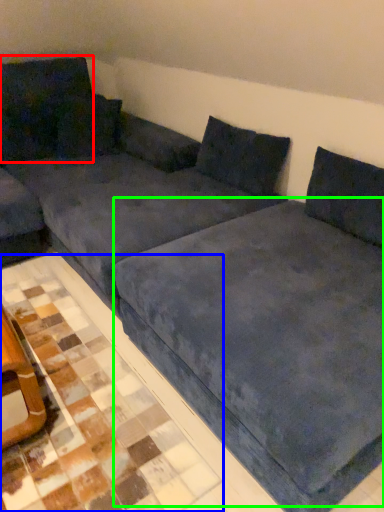
Question: Which object is positioned farthest from pillow (highlighted by a red box)? Select from tile (highlighted by a blue box) and bedding (highlighted by a green box).

Choices:
 (A) tile
 (B) bedding

Answer: (B)